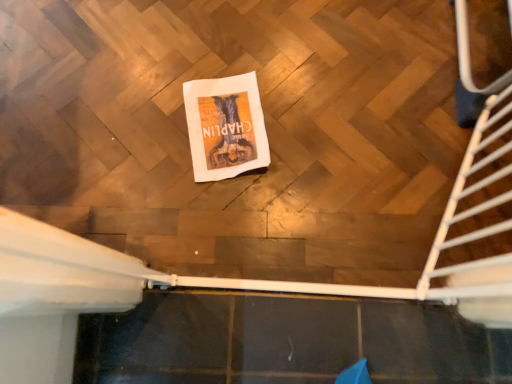
Question: Visually, is white paper towel at center positioned to the left or to the right of white metal stairs at right?

Choices:
 (A) left
 (B) right

Answer: (A)

Question: From a real-world perspective, is white paper towel at center above or below white metal stairs at right?

Choices:
 (A) below
 (B) above

Answer: (A)

Question: Is white paper towel at center bigger or smaller than white metal stairs at right?

Choices:
 (A) big
 (B) small

Answer: (B)

Question: Is white metal stairs at right spatially inside white paper towel at center, or outside of it?

Choices:
 (A) outside
 (B) inside

Answer: (A)

Question: From their relative heights in the image, would you say white metal stairs at right is taller or shorter than white paper towel at center?

Choices:
 (A) tall
 (B) short

Answer: (A)

Question: From the image's perspective, is white metal stairs at right above or below white paper towel at center?

Choices:
 (A) above
 (B) below

Answer: (B)

Question: Looking at their shapes, would you say white metal stairs at right is wider or thinner than white paper towel at center?

Choices:
 (A) thin
 (B) wide

Answer: (A)